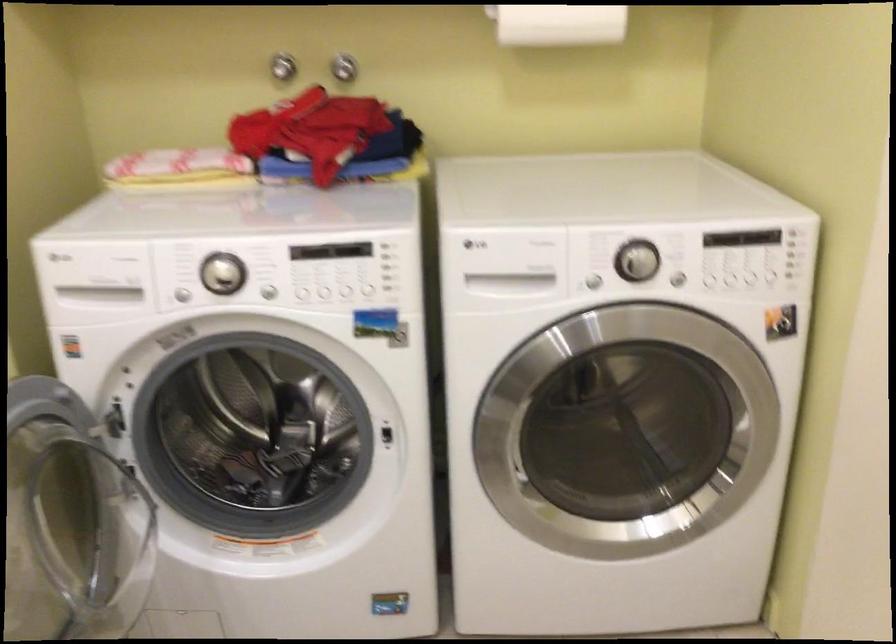
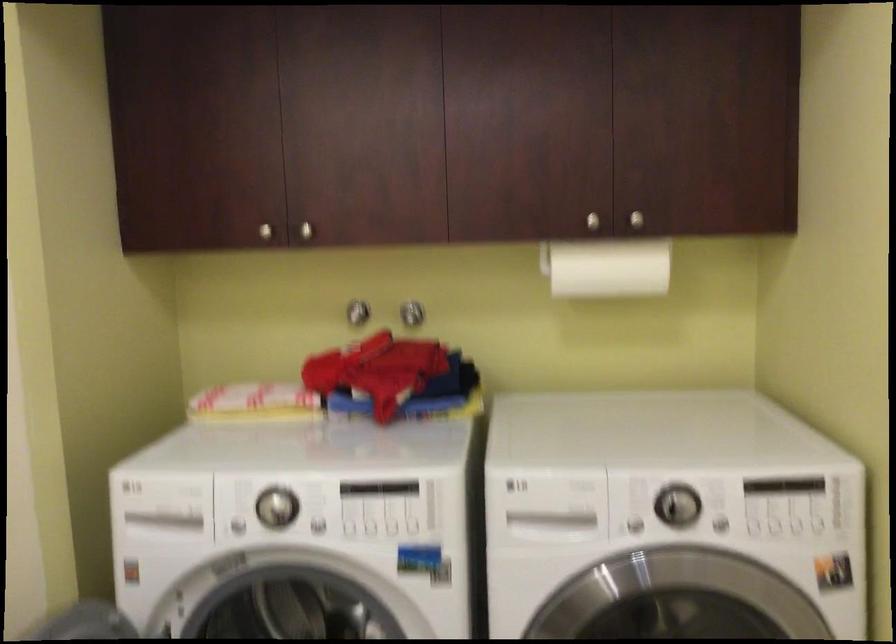
In a continuous first-person perspective shot, in which direction is the camera moving?

The movement direction of the cameraman is right, backward.